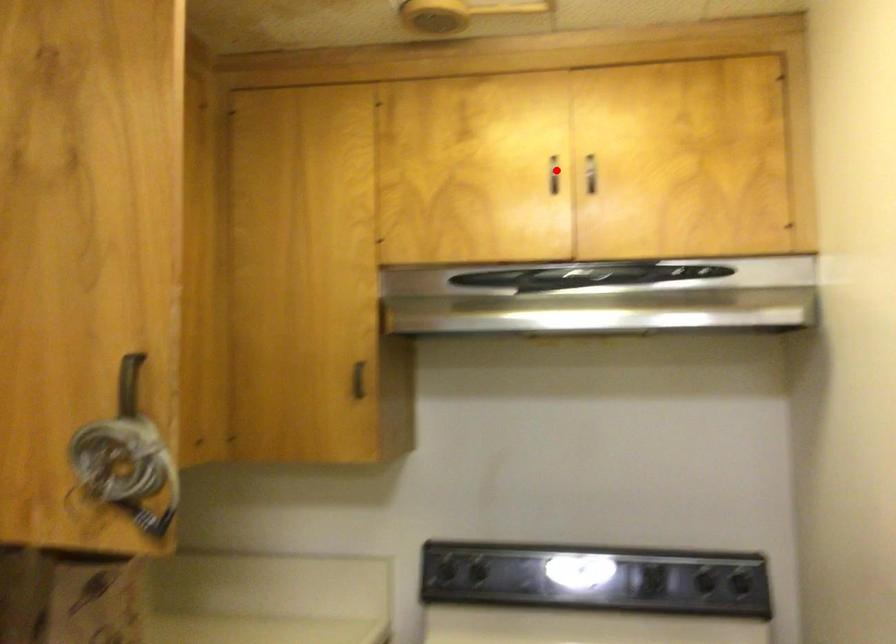
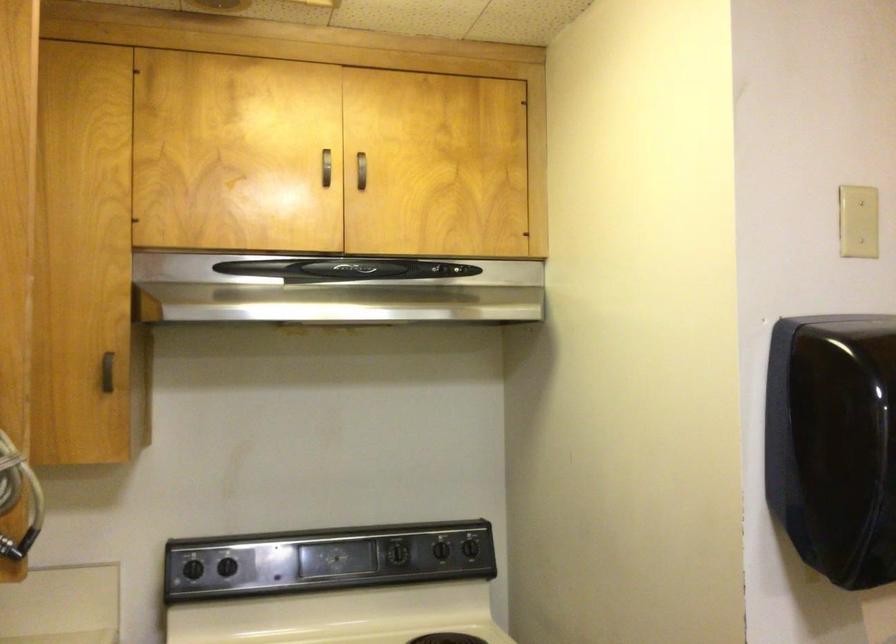
Where in the second image is the point corresponding to the highlighted location from the first image?

(325, 167)